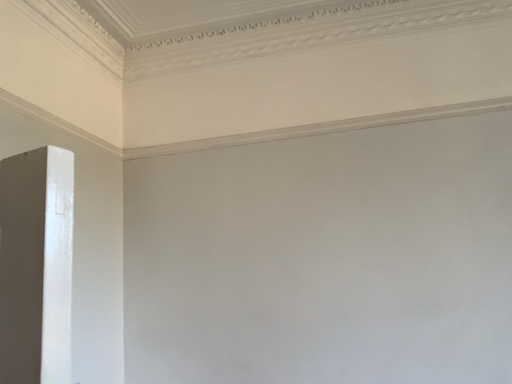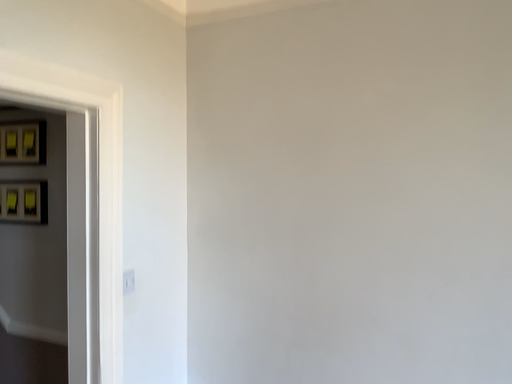
Question: Which way did the camera rotate in the video?

Choices:
 (A) rotated downward
 (B) rotated upward

Answer: (A)